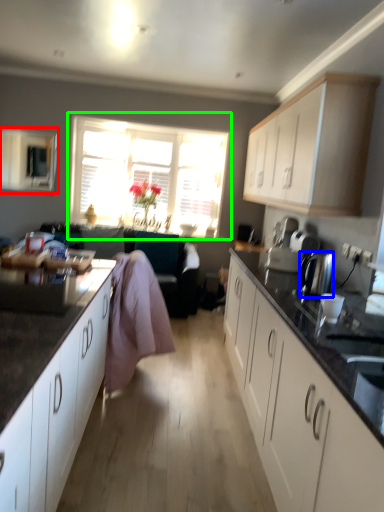
Question: Estimate the real-world distances between objects in this image. Which object is closer to window screen (highlighted by a red box), kitchen appliance (highlighted by a blue box) or window (highlighted by a green box)?

Choices:
 (A) kitchen appliance
 (B) window

Answer: (B)